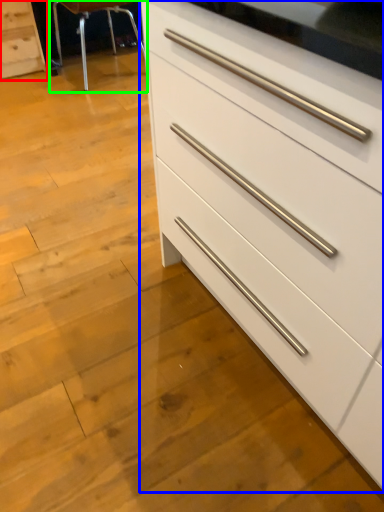
Question: Which is nearer to the chest of drawers (highlighted by a red box)? chest of drawers (highlighted by a blue box) or bar stool (highlighted by a green box).

Choices:
 (A) chest of drawers
 (B) bar stool

Answer: (B)